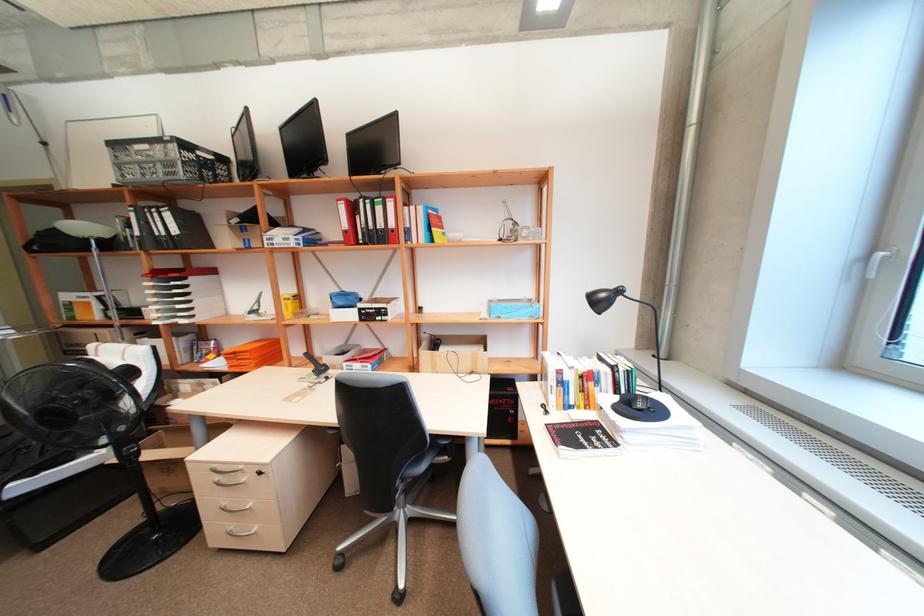
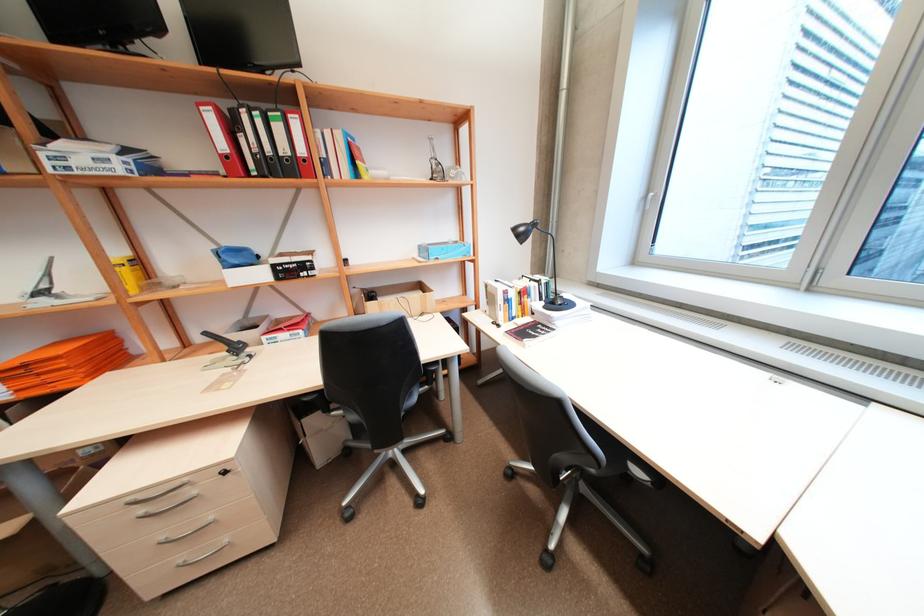
Question: The first image is from the beginning of the video and the second image is from the end. How did the camera likely rotate when shooting the video?

Choices:
 (A) Left
 (B) Right
 (C) Up
 (D) Down

Answer: (B)